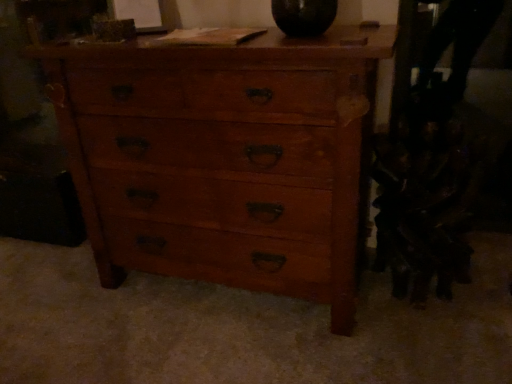
Describe the element at coordinates (431, 169) in the screenshot. I see `dark brown leather swivel chair at right` at that location.

This screenshot has height=384, width=512. What are the coordinates of `dark brown leather swivel chair at right` in the screenshot? It's located at (431, 169).

Describe the element at coordinates (224, 157) in the screenshot. This screenshot has width=512, height=384. I see `wooden chest of drawers at center` at that location.

The width and height of the screenshot is (512, 384). Identify the location of wooden chest of drawers at center. (224, 157).

In order to face wooden chest of drawers at center, should I rotate leftwards or rightwards?

You should rotate left by 4.017 degrees.

Where is `dark brown leather swivel chair at right`? This screenshot has width=512, height=384. dark brown leather swivel chair at right is located at coordinates (431, 169).

Considering the relative positions of dark brown leather swivel chair at right and wooden chest of drawers at center in the image provided, is dark brown leather swivel chair at right to the left of wooden chest of drawers at center from the viewer's perspective?

No.

Between dark brown leather swivel chair at right and wooden chest of drawers at center, which one is positioned behind?

→ dark brown leather swivel chair at right is more distant.

Does point (495, 6) come in front of point (288, 129)?

No, (495, 6) is behind (288, 129).

From the image's perspective, relative to wooden chest of drawers at center, is dark brown leather swivel chair at right above or below?

From the image's perspective, dark brown leather swivel chair at right appears below wooden chest of drawers at center.

From a real-world perspective, is dark brown leather swivel chair at right positioned under wooden chest of drawers at center based on gravity?

Correct, in the physical world, dark brown leather swivel chair at right is lower than wooden chest of drawers at center.

Is dark brown leather swivel chair at right wider or thinner than wooden chest of drawers at center?

Clearly, dark brown leather swivel chair at right has less width compared to wooden chest of drawers at center.

Is dark brown leather swivel chair at right taller or shorter than wooden chest of drawers at center?

dark brown leather swivel chair at right is shorter than wooden chest of drawers at center.

Which of these two, dark brown leather swivel chair at right or wooden chest of drawers at center, is bigger?

wooden chest of drawers at center is bigger.

Is wooden chest of drawers at center completely or partially inside dark brown leather swivel chair at right?

No.

Is dark brown leather swivel chair at right next to wooden chest of drawers at center?

There is a gap between dark brown leather swivel chair at right and wooden chest of drawers at center.

Is dark brown leather swivel chair at right oriented away from wooden chest of drawers at center?

No, dark brown leather swivel chair at right is not facing away from wooden chest of drawers at center.

Measure the distance from dark brown leather swivel chair at right to wooden chest of drawers at center.

dark brown leather swivel chair at right and wooden chest of drawers at center are 20.88 inches apart from each other.

The height and width of the screenshot is (384, 512). In order to click on swivel chair that is behind the wooden chest of drawers at center in this screenshot , I will do `click(431, 169)`.

Is wooden chest of drawers at center to the left of dark brown leather swivel chair at right from the viewer's perspective?

Yes, wooden chest of drawers at center is to the left of dark brown leather swivel chair at right.

Relative to dark brown leather swivel chair at right, is wooden chest of drawers at center in front or behind?

Clearly, wooden chest of drawers at center is in front of dark brown leather swivel chair at right.

Is point (279, 77) closer or farther from the camera than point (468, 45)?

Point (279, 77) is closer to the camera than point (468, 45).

From the image's perspective, is wooden chest of drawers at center over dark brown leather swivel chair at right?

Correct, wooden chest of drawers at center appears higher than dark brown leather swivel chair at right in the image.

From a real-world perspective, which is physically below, wooden chest of drawers at center or dark brown leather swivel chair at right?

From a 3D spatial view, dark brown leather swivel chair at right is below.

From the picture: Is wooden chest of drawers at center wider than dark brown leather swivel chair at right?

Correct, the width of wooden chest of drawers at center exceeds that of dark brown leather swivel chair at right.

Which of these two, wooden chest of drawers at center or dark brown leather swivel chair at right, stands shorter?

dark brown leather swivel chair at right is shorter.

Is wooden chest of drawers at center bigger or smaller than dark brown leather swivel chair at right?

Considering their sizes, wooden chest of drawers at center takes up more space than dark brown leather swivel chair at right.

Would you say wooden chest of drawers at center is outside dark brown leather swivel chair at right?

wooden chest of drawers at center is positioned outside dark brown leather swivel chair at right.

In the scene shown: Is wooden chest of drawers at center placed right next to dark brown leather swivel chair at right?

No, wooden chest of drawers at center is not making contact with dark brown leather swivel chair at right.

Is wooden chest of drawers at center turned away from dark brown leather swivel chair at right?

That's not correct — wooden chest of drawers at center is not looking away from dark brown leather swivel chair at right.

Identify the location of swivel chair below the wooden chest of drawers at center (from the image's perspective). Image resolution: width=512 pixels, height=384 pixels. (431, 169).

The image size is (512, 384). I want to click on chest of drawers to the left of dark brown leather swivel chair at right, so click(224, 157).

Where is `swivel chair behind the wooden chest of drawers at center`? swivel chair behind the wooden chest of drawers at center is located at coordinates (431, 169).